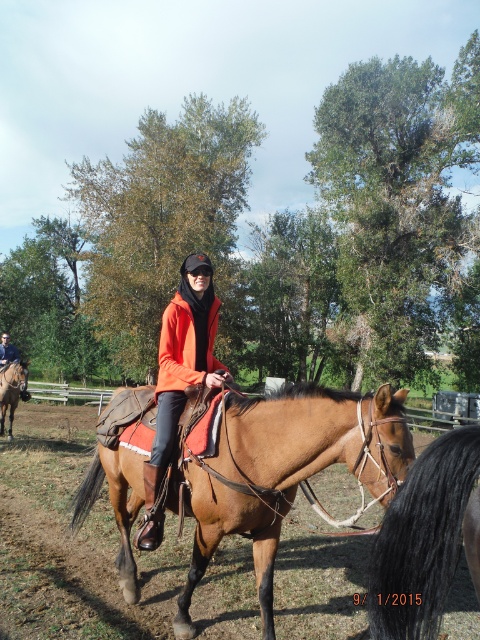
Question: Considering the real-world distances, which object is farthest from the brown leather saddle at center?

Choices:
 (A) black glossy horse tail at lower right
 (B) orange fleece jacket at center
 (C) orange matte jacket at center

Answer: (B)

Question: Is brown leather saddle at center thinner than orange fleece jacket at center?

Choices:
 (A) yes
 (B) no

Answer: (B)

Question: Is orange matte jacket at center above orange fabric jacket at center?

Choices:
 (A) no
 (B) yes

Answer: (A)

Question: Does brown leather saddle at center appear on the right side of orange matte jacket at center?

Choices:
 (A) no
 (B) yes

Answer: (A)

Question: Which of the following is the closest to the observer?

Choices:
 (A) (184, 273)
 (B) (23, 369)
 (C) (1, 362)

Answer: (A)

Question: Among these points, which one is farthest from the camera?

Choices:
 (A) (468, 468)
 (B) (137, 468)

Answer: (B)